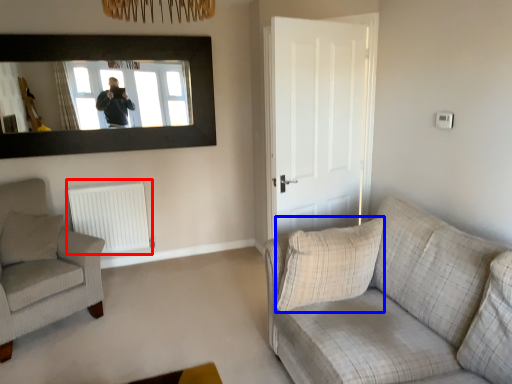
Question: Which object is closer to the camera taking this photo, radiator (highlighted by a red box) or pillow (highlighted by a blue box)?

Choices:
 (A) radiator
 (B) pillow

Answer: (B)